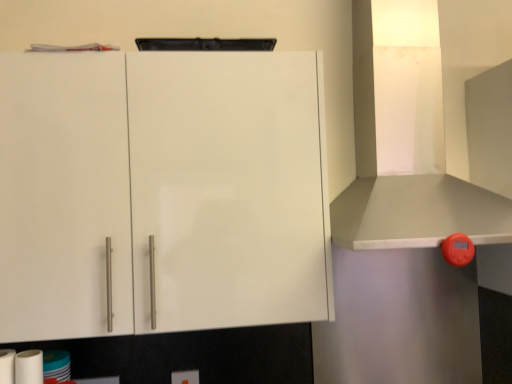
Where is `white matte paper towel at lower left, the 2th paper towel in the right-to-left sequence`? This screenshot has width=512, height=384. white matte paper towel at lower left, the 2th paper towel in the right-to-left sequence is located at coordinates (7, 366).

The width and height of the screenshot is (512, 384). I want to click on white glossy toilet paper at lower left, so click(x=29, y=367).

From the image's perspective, is white matte paper towel at lower left, the 1th paper towel from the left, on white glossy toilet paper at lower left?

Yes.

Consider the image. Is white matte paper towel at lower left, the 2th paper towel in the right-to-left sequence, oriented towards white glossy toilet paper at lower left?

No, white matte paper towel at lower left, the 2th paper towel in the right-to-left sequence, does not turn towards white glossy toilet paper at lower left.

From the picture: Can you see white matte paper towel at lower left, the 2th paper towel in the right-to-left sequence, touching white glossy toilet paper at lower left?

Yes, white matte paper towel at lower left, the 2th paper towel in the right-to-left sequence, is in contact with white glossy toilet paper at lower left.

Which of these two, white matte paper towel at lower left, the 2th paper towel in the right-to-left sequence, or white glossy toilet paper at lower left, is thinner?

With smaller width is white matte paper towel at lower left, the 2th paper towel in the right-to-left sequence.

Is white matte paper towel at lower left, the 2th paper towel viewed from the left, spatially inside white glossy exhaust hood at upper right, or outside of it?

white matte paper towel at lower left, the 2th paper towel viewed from the left, is not enclosed by white glossy exhaust hood at upper right.

Is point (29, 376) less distant than point (474, 181)?

Yes, point (29, 376) is in front of point (474, 181).

Which of these two, white glossy toilet paper at lower left or white matte paper towel at lower left, the 1th paper towel from the left, stands shorter?

With less height is white glossy toilet paper at lower left.

Who is bigger, white glossy toilet paper at lower left or white matte paper towel at lower left, the 2th paper towel in the right-to-left sequence?

white glossy toilet paper at lower left.

Can we say white glossy toilet paper at lower left lies outside white matte paper towel at lower left, the 2th paper towel in the right-to-left sequence?

white glossy toilet paper at lower left is positioned outside white matte paper towel at lower left, the 2th paper towel in the right-to-left sequence.

Which is closer, (42,374) or (6,361)?

Point (42,374) appears to be farther away from the viewer than point (6,361).

Can you see white matte paper towel at lower left, the 2th paper towel in the right-to-left sequence, touching white glossy exhaust hood at upper right?

No, white matte paper towel at lower left, the 2th paper towel in the right-to-left sequence, is not in contact with white glossy exhaust hood at upper right.

Does white matte paper towel at lower left, the 2th paper towel in the right-to-left sequence, have a larger size compared to white glossy exhaust hood at upper right?

No, white matte paper towel at lower left, the 2th paper towel in the right-to-left sequence, is not bigger than white glossy exhaust hood at upper right.

Is white matte paper towel at lower left, the 2th paper towel in the right-to-left sequence, facing away from white glossy exhaust hood at upper right?

No, white matte paper towel at lower left, the 2th paper towel in the right-to-left sequence, is not facing the opposite direction of white glossy exhaust hood at upper right.

Which is behind, white matte paper towel at lower left, the 2th paper towel in the right-to-left sequence, or white glossy exhaust hood at upper right?

white matte paper towel at lower left, the 2th paper towel in the right-to-left sequence, is further from the camera.

From the image's perspective, would you say white glossy toilet paper at lower left is shown under white matte paper towel at lower left, arranged as the first paper towel when viewed from the right?

Indeed, from the image's perspective, white glossy toilet paper at lower left is shown beneath white matte paper towel at lower left, arranged as the first paper towel when viewed from the right.

From a real-world perspective, which object stands above the other?

white matte paper towel at lower left, arranged as the first paper towel when viewed from the right, is physically above.

Which is behind, point (17, 379) or point (39, 357)?

Point (39, 357)

Which of these two, white glossy toilet paper at lower left or white matte paper towel at lower left, the 2th paper towel viewed from the left, is wider?

white glossy toilet paper at lower left is wider.

Is white glossy toilet paper at lower left facing away from white glossy exhaust hood at upper right?

That's not correct — white glossy toilet paper at lower left is not looking away from white glossy exhaust hood at upper right.

Which object is further away from the camera taking this photo, white glossy toilet paper at lower left or white glossy exhaust hood at upper right?

white glossy toilet paper at lower left is behind.

Is there a large distance between white glossy toilet paper at lower left and white glossy exhaust hood at upper right?

That's right, there is a large distance between white glossy toilet paper at lower left and white glossy exhaust hood at upper right.

Measure the distance between white glossy toilet paper at lower left and white glossy exhaust hood at upper right.

white glossy toilet paper at lower left is 3.28 meters away from white glossy exhaust hood at upper right.

Is white matte paper towel at lower left, the 1th paper towel from the left, placed right next to white matte paper towel at lower left, arranged as the first paper towel when viewed from the right?

Indeed, white matte paper towel at lower left, the 1th paper towel from the left, and white matte paper towel at lower left, arranged as the first paper towel when viewed from the right, are beside each other and touching.

Locate an element on the screen. The height and width of the screenshot is (384, 512). paper towel lying below the white matte paper towel at lower left, arranged as the first paper towel when viewed from the right (from the image's perspective) is located at coordinates (7, 366).

From a real-world perspective, is white matte paper towel at lower left, the 2th paper towel in the right-to-left sequence, positioned under white matte paper towel at lower left, the 2th paper towel viewed from the left, based on gravity?

Indeed, from a real-world perspective, white matte paper towel at lower left, the 2th paper towel in the right-to-left sequence, is positioned beneath white matte paper towel at lower left, the 2th paper towel viewed from the left.

Based on the photo, considering the positions of objects white matte paper towel at lower left, the 2th paper towel in the right-to-left sequence, and white matte paper towel at lower left, the 2th paper towel viewed from the left, in the image provided, who is behind, white matte paper towel at lower left, the 2th paper towel in the right-to-left sequence, or white matte paper towel at lower left, the 2th paper towel viewed from the left,?

white matte paper towel at lower left, the 2th paper towel viewed from the left, is behind.

This screenshot has height=384, width=512. Find the location of `toilet paper below the white matte paper towel at lower left, the 2th paper towel in the right-to-left sequence (from a real-world perspective)`. toilet paper below the white matte paper towel at lower left, the 2th paper towel in the right-to-left sequence (from a real-world perspective) is located at coordinates (29, 367).

From the image's perspective, count 1st paper towels downward from the white glossy exhaust hood at upper right and point to it. Please provide its 2D coordinates.

[(29, 367)]

Which object lies further to the anchor point white glossy cabinet at upper left, white matte paper towel at lower left, the 2th paper towel in the right-to-left sequence, or white matte paper towel at lower left, the 2th paper towel viewed from the left?

white matte paper towel at lower left, the 2th paper towel in the right-to-left sequence.

From the image, which object appears to be nearer to white matte paper towel at lower left, arranged as the first paper towel when viewed from the right, white glossy exhaust hood at upper right or white glossy toilet paper at lower left?

white glossy toilet paper at lower left lies closer to white matte paper towel at lower left, arranged as the first paper towel when viewed from the right, than the other object.

Looking at the image, which one is located closer to white matte paper towel at lower left, arranged as the first paper towel when viewed from the right, white glossy cabinet at upper left or white glossy toilet paper at lower left?

white glossy toilet paper at lower left is positioned closer to the anchor white matte paper towel at lower left, arranged as the first paper towel when viewed from the right.

Considering their positions, is white matte paper towel at lower left, arranged as the first paper towel when viewed from the right, positioned closer to white matte paper towel at lower left, the 1th paper towel from the left, than white glossy cabinet at upper left?

white matte paper towel at lower left, arranged as the first paper towel when viewed from the right, lies closer to white matte paper towel at lower left, the 1th paper towel from the left, than the other object.

Based on the photo, based on their spatial positions, is white glossy exhaust hood at upper right or white glossy cabinet at upper left closer to white matte paper towel at lower left, arranged as the first paper towel when viewed from the right?

white glossy cabinet at upper left lies closer to white matte paper towel at lower left, arranged as the first paper towel when viewed from the right, than the other object.

From the picture: Considering their positions, is white glossy exhaust hood at upper right positioned closer to white glossy toilet paper at lower left than white glossy cabinet at upper left?

white glossy cabinet at upper left lies closer to white glossy toilet paper at lower left than the other object.

When comparing their distances from white matte paper towel at lower left, the 1th paper towel from the left, does white glossy exhaust hood at upper right or white glossy toilet paper at lower left seem closer?

Based on the image, white glossy toilet paper at lower left appears to be nearer to white matte paper towel at lower left, the 1th paper towel from the left.

Which object lies nearer to the anchor point white matte paper towel at lower left, the 2th paper towel in the right-to-left sequence, white glossy cabinet at upper left or white matte paper towel at lower left, arranged as the first paper towel when viewed from the right?

white matte paper towel at lower left, arranged as the first paper towel when viewed from the right, is positioned closer to the anchor white matte paper towel at lower left, the 2th paper towel in the right-to-left sequence.

You are a GUI agent. You are given a task and a screenshot of the screen. Output one action in this format:
    pyautogui.click(x=<x>, y=<y>)
    Task: Click on the paper towel between white glossy cabinet at upper left and white matte paper towel at lower left, the 2th paper towel in the right-to-left sequence, in the up-down direction
    
    Given the screenshot: What is the action you would take?
    [29, 367]

Find the location of a particular element. The image size is (512, 384). cabinetry situated between white matte paper towel at lower left, the 2th paper towel in the right-to-left sequence, and white glossy exhaust hood at upper right from left to right is located at coordinates (162, 191).

I want to click on paper towel located between white matte paper towel at lower left, the 2th paper towel in the right-to-left sequence, and white glossy exhaust hood at upper right in the left-right direction, so click(29, 367).

Where is `cabinetry between white matte paper towel at lower left, arranged as the first paper towel when viewed from the right, and white glossy exhaust hood at upper right`? cabinetry between white matte paper towel at lower left, arranged as the first paper towel when viewed from the right, and white glossy exhaust hood at upper right is located at coordinates [x=162, y=191].